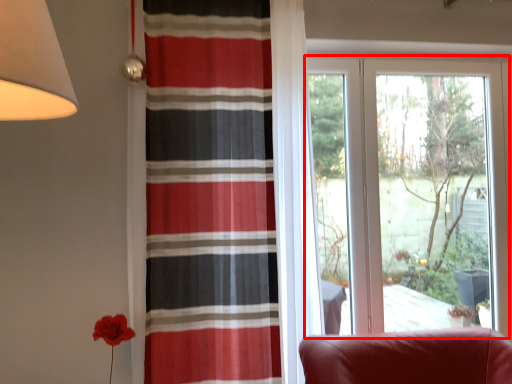
Question: From the image's perspective, considering the relative positions of window (annotated by the red box) and curtain in the image provided, where is window (annotated by the red box) located with respect to the staircase?

Choices:
 (A) below
 (B) above

Answer: (A)